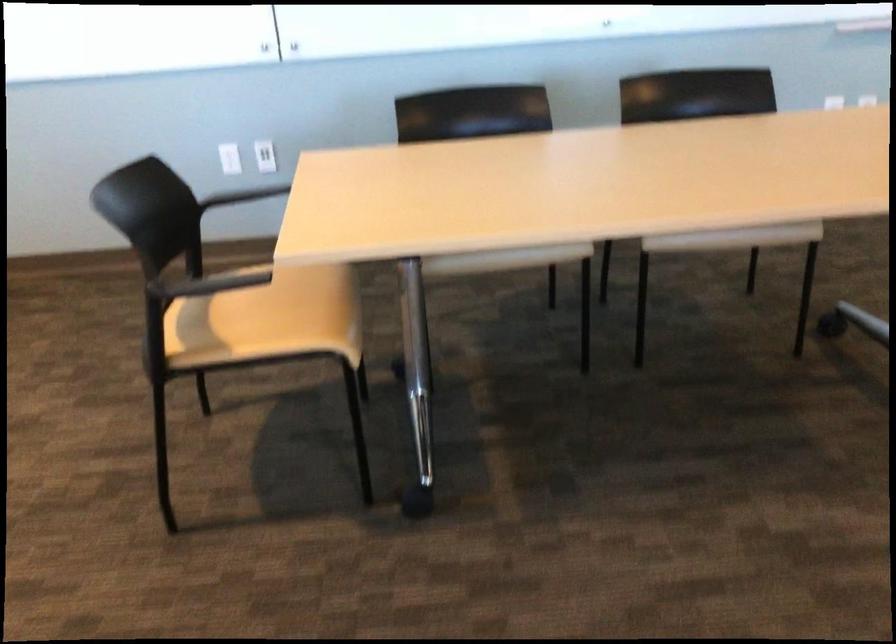
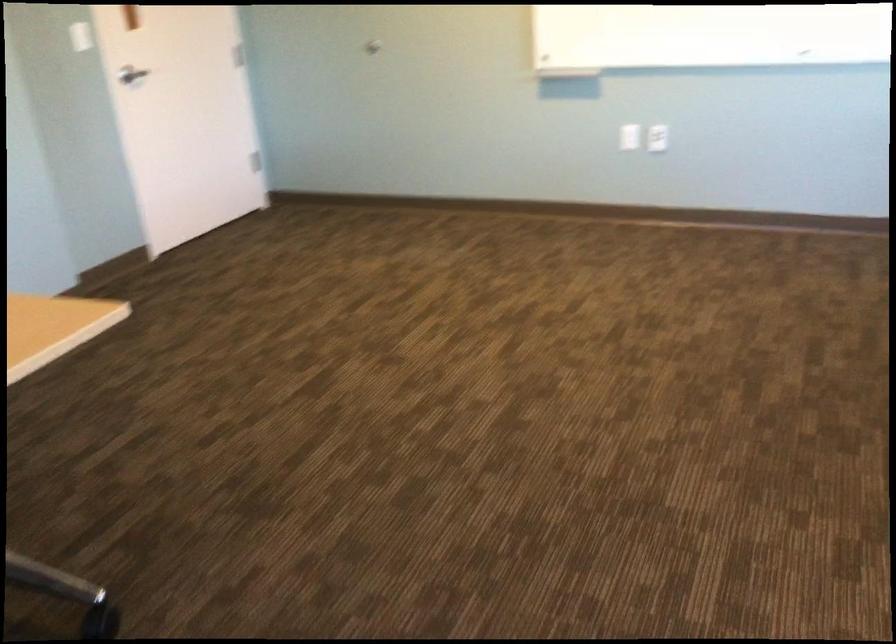
Question: The first image is from the beginning of the video and the second image is from the end. How did the camera likely rotate when shooting the video?

Choices:
 (A) Left
 (B) Right
 (C) Up
 (D) Down

Answer: (B)